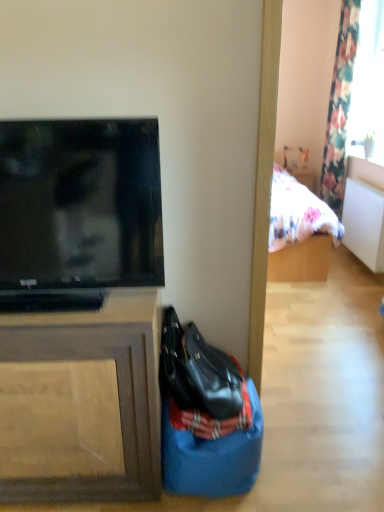
This screenshot has height=512, width=384. What are the coordinates of `matte black television at left` in the screenshot? It's located at (78, 211).

What do you see at coordinates (78, 211) in the screenshot?
I see `matte black television at left` at bounding box center [78, 211].

Find the location of a particular element. This screenshot has height=512, width=384. blue fabric sack at lower center is located at coordinates (212, 458).

The width and height of the screenshot is (384, 512). What do you see at coordinates (368, 84) in the screenshot? I see `transparent glass window at upper right` at bounding box center [368, 84].

I want to click on floral fabric curtain at upper right, so click(340, 106).

Which is more to the left, blue fabric sack at lower center or shiny black handbag at lower center?

shiny black handbag at lower center.

Is blue fabric sack at lower center inside or outside of shiny black handbag at lower center?

blue fabric sack at lower center is not inside shiny black handbag at lower center, it's outside.

Looking at this image, is blue fabric sack at lower center facing away from shiny black handbag at lower center?

blue fabric sack at lower center does not have its back to shiny black handbag at lower center.

Considering the sizes of transparent glass window at upper right and shiny black handbag at lower center in the image, is transparent glass window at upper right bigger or smaller than shiny black handbag at lower center?

transparent glass window at upper right is bigger than shiny black handbag at lower center.

Is the surface of transparent glass window at upper right in direct contact with shiny black handbag at lower center?

A: No, transparent glass window at upper right is not beside shiny black handbag at lower center.

Is transparent glass window at upper right oriented away from shiny black handbag at lower center?

No, shiny black handbag at lower center is not at the back of transparent glass window at upper right.

From the image's perspective, which is below, transparent glass window at upper right or shiny black handbag at lower center?

shiny black handbag at lower center, from the image's perspective.

Is blue fabric sack at lower center in front of or behind transparent glass window at upper right in the image?

blue fabric sack at lower center is positioned closer to the viewer than transparent glass window at upper right.

Is blue fabric sack at lower center positioned with its back to transparent glass window at upper right?

No, blue fabric sack at lower center is not facing away from transparent glass window at upper right.

The height and width of the screenshot is (512, 384). Identify the location of sack on the left of transparent glass window at upper right. (212, 458).

Is blue fabric sack at lower center inside or outside of transparent glass window at upper right?

blue fabric sack at lower center is not inside transparent glass window at upper right, it's outside.

Is shiny black handbag at lower center placed right next to brown wood cabinet at left?

No, shiny black handbag at lower center is not with brown wood cabinet at left.

From the image's perspective, would you say shiny black handbag at lower center is positioned over brown wood cabinet at left?

Yes, from the image's perspective, shiny black handbag at lower center is on top of brown wood cabinet at left.

Is point (198, 381) closer or farther from the camera than point (140, 318)?

Point (198, 381).

In terms of width, does shiny black handbag at lower center look wider or thinner when compared to brown wood cabinet at left?

shiny black handbag at lower center is thinner than brown wood cabinet at left.

From a real-world perspective, is transparent glass window at upper right on top of floral fabric curtain at upper right?

Indeed, from a real-world perspective, transparent glass window at upper right stands above floral fabric curtain at upper right.

From the image's perspective, who appears lower, transparent glass window at upper right or floral fabric curtain at upper right?

floral fabric curtain at upper right.

Based on their positions, is transparent glass window at upper right located to the left or right of floral fabric curtain at upper right?

transparent glass window at upper right is to the right of floral fabric curtain at upper right.

Does point (375, 100) come closer to viewer compared to point (329, 187)?

Yes.

Is blue fabric sack at lower center aimed at floral fabric curtain at upper right?

No, blue fabric sack at lower center does not turn towards floral fabric curtain at upper right.

From a real-world perspective, which object rests below the other?

In real-world perspective, blue fabric sack at lower center is lower.

From the image's perspective, is blue fabric sack at lower center located above floral fabric curtain at upper right?

No, from the image's perspective, blue fabric sack at lower center is not above floral fabric curtain at upper right.

Would you say brown wood cabinet at left is outside floral fabric curtain at upper right?

Yes.

From the image's perspective, which one is positioned lower, brown wood cabinet at left or floral fabric curtain at upper right?

From the image's view, brown wood cabinet at left is below.

Considering the relative sizes of brown wood cabinet at left and floral fabric curtain at upper right in the image provided, is brown wood cabinet at left bigger than floral fabric curtain at upper right?

Yes, brown wood cabinet at left is bigger than floral fabric curtain at upper right.

At what (x,y) coordinates should I click in order to perform the action: click on sack behind the shiny black handbag at lower center. Please return your answer as a coordinate pair (x, y). This screenshot has width=384, height=512. Looking at the image, I should click on (212, 458).

This screenshot has height=512, width=384. Find the location of `window screen that appears above the shiny black handbag at lower center (from a real-world perspective)`. window screen that appears above the shiny black handbag at lower center (from a real-world perspective) is located at coordinates (368, 84).

Looking at the image, which one is located further to floral fabric curtain at upper right, transparent glass window at upper right or blue fabric sack at lower center?

blue fabric sack at lower center is further to floral fabric curtain at upper right.

Estimate the real-world distances between objects in this image. Which object is closer to brown wood cabinet at left, transparent glass window at upper right or shiny black handbag at lower center?

shiny black handbag at lower center.

From the image, which object appears to be nearer to transparent glass window at upper right, shiny black handbag at lower center or floral fabric curtain at upper right?

Based on the image, floral fabric curtain at upper right appears to be nearer to transparent glass window at upper right.

Looking at this image, looking at the image, which one is located closer to blue fabric sack at lower center, brown wood cabinet at left or floral fabric curtain at upper right?

brown wood cabinet at left is positioned closer to the anchor blue fabric sack at lower center.

Estimate the real-world distances between objects in this image. Which object is further from brown wood cabinet at left, matte black television at left or shiny black handbag at lower center?

shiny black handbag at lower center lies further to brown wood cabinet at left than the other object.

Based on their spatial positions, is matte black television at left or blue fabric sack at lower center closer to floral fabric curtain at upper right?

Among the two, blue fabric sack at lower center is located nearer to floral fabric curtain at upper right.

Consider the image. Considering their positions, is blue fabric sack at lower center positioned closer to shiny black handbag at lower center than floral fabric curtain at upper right?

The object closer to shiny black handbag at lower center is blue fabric sack at lower center.

Looking at the image, which one is located closer to blue fabric sack at lower center, matte black television at left or shiny black handbag at lower center?

shiny black handbag at lower center is closer to blue fabric sack at lower center.

Where is `cabinetry between transparent glass window at upper right and blue fabric sack at lower center in the up-down direction`? cabinetry between transparent glass window at upper right and blue fabric sack at lower center in the up-down direction is located at coordinates (82, 402).

The image size is (384, 512). Identify the location of cabinetry that lies between matte black television at left and blue fabric sack at lower center from top to bottom. (82, 402).

Identify the location of window screen between matte black television at left and floral fabric curtain at upper right along the z-axis. This screenshot has width=384, height=512. (368, 84).

This screenshot has height=512, width=384. I want to click on window screen between brown wood cabinet at left and floral fabric curtain at upper right from front to back, so click(368, 84).